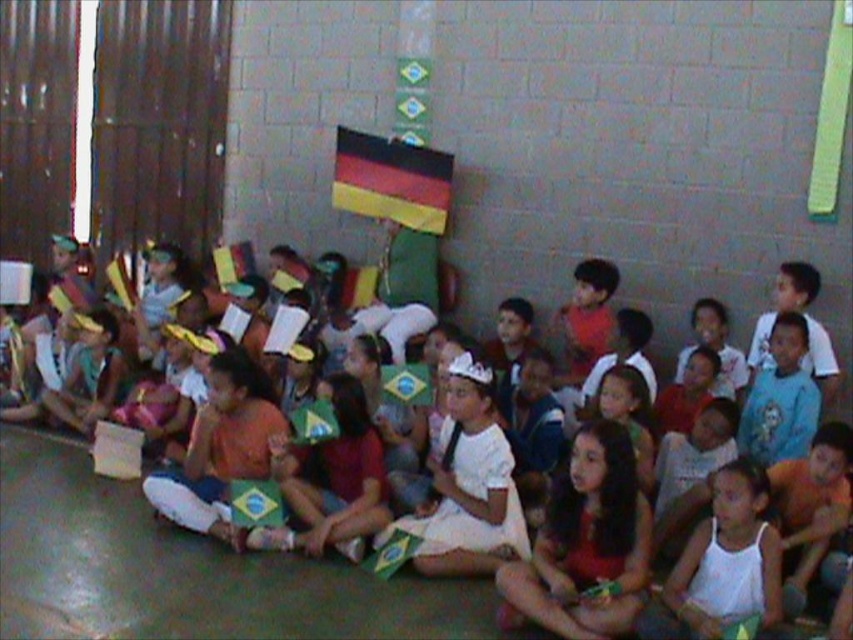
At what (x,y) coordinates should I click in order to perform the action: click on white paper hat at center. Please return your answer as a coordinate pair (x, y). The image size is (853, 640). Looking at the image, I should click on (181, 570).

Identify the location of white paper hat at center. click(181, 570).

Identify the location of white paper hat at center. (181, 570).